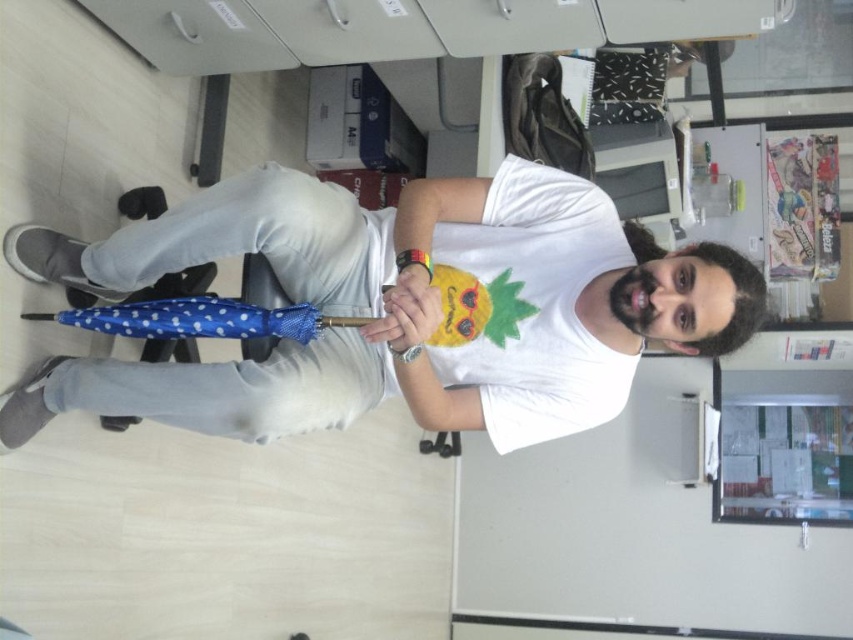
Between blue polka dot umbrella at center and blue polka dot umbrella at lower left, which one has more height?

blue polka dot umbrella at center

Between blue polka dot umbrella at center and blue polka dot umbrella at lower left, which one appears on the right side from the viewer's perspective?

blue polka dot umbrella at center

Does point (187, 396) come farther from viewer compared to point (102, 310)?

No.

Find the location of `blue polka dot umbrella at center`. blue polka dot umbrella at center is located at coordinates coord(401,307).